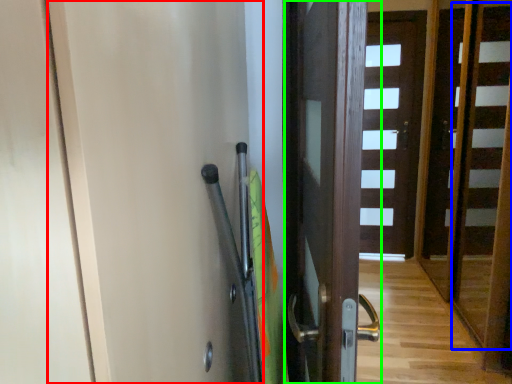
Question: Which object is the farthest from screen door (highlighted by a red box)? Choose among these: stair (highlighted by a blue box) or door (highlighted by a green box).

Choices:
 (A) stair
 (B) door

Answer: (A)